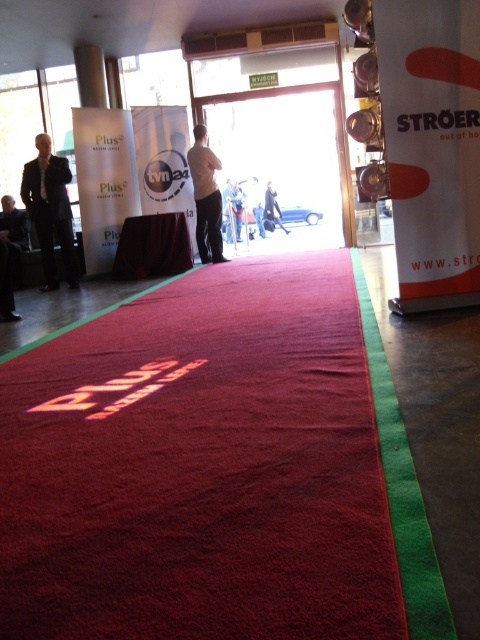
Question: Which object is positioned closest to the dark blue suit at center?

Choices:
 (A) dark gray suit at left
 (B) red carpet at center
 (C) light beige fabric pants at center
 (D) matte black suit at left

Answer: (C)

Question: Does red carpet at center have a smaller size compared to matte black suit at left?

Choices:
 (A) yes
 (B) no

Answer: (B)

Question: Is dark gray suit at left smaller than dark blue suit at center?

Choices:
 (A) yes
 (B) no

Answer: (B)

Question: Among these objects, which one is farthest from the camera?

Choices:
 (A) red carpet at center
 (B) dark gray suit at left
 (C) light beige fabric pants at center
 (D) dark blue suit at center

Answer: (D)

Question: Among these objects, which one is farthest from the camera?

Choices:
 (A) dark gray suit at left
 (B) dark blue suit at center
 (C) matte black suit at left
 (D) red carpet at center

Answer: (B)

Question: Is dark gray suit at left positioned behind dark blue suit at center?

Choices:
 (A) no
 (B) yes

Answer: (A)